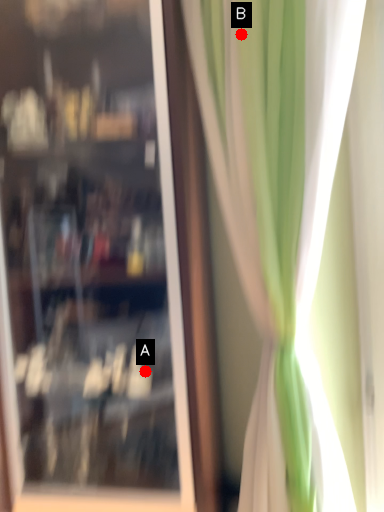
Question: Two points are circled on the image, labeled by A and B beside each circle. Which of the following is the closest to the observer?

Choices:
 (A) A is closer
 (B) B is closer

Answer: (B)